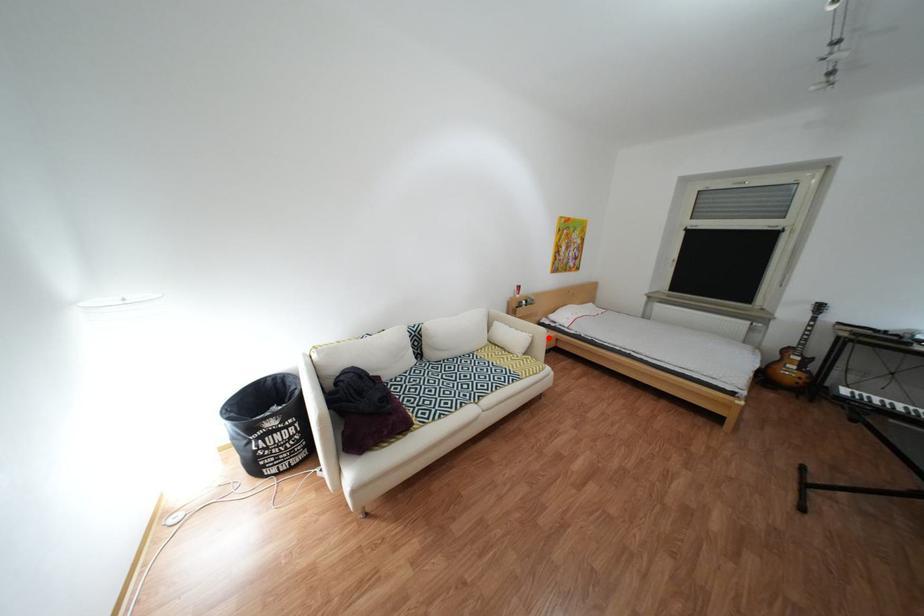
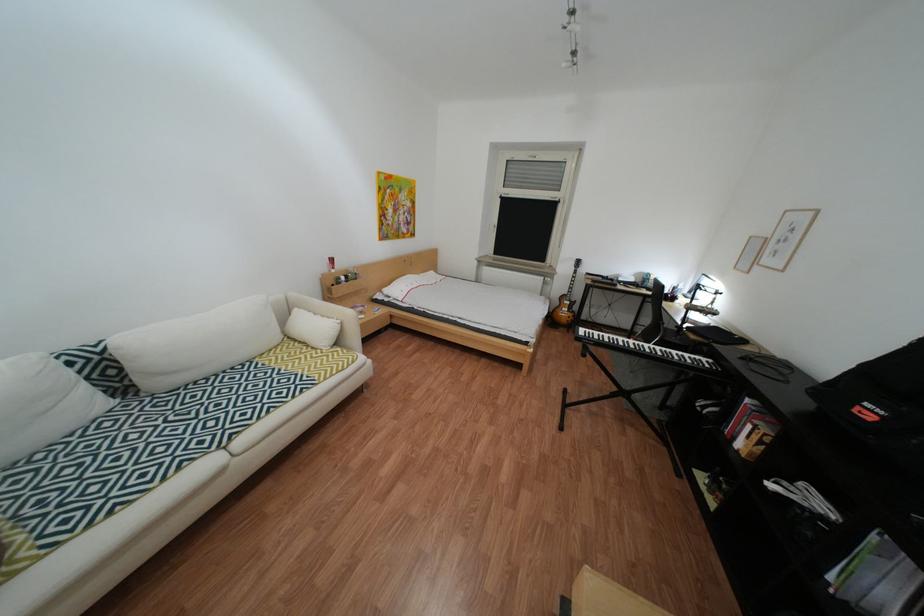
Locate, in the second image, the point that corresponds to the highlighted location in the first image.

(358, 323)